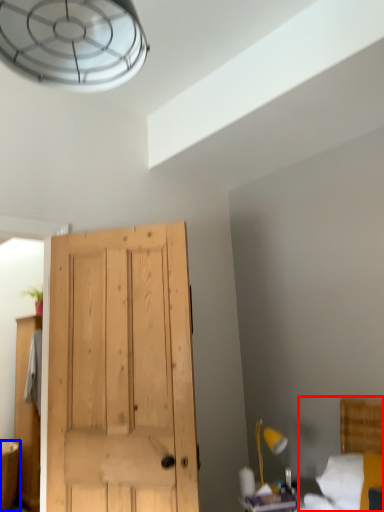
Question: Which object is further to the camera taking this photo, bed (highlighted by a red box) or vanity (highlighted by a blue box)?

Choices:
 (A) bed
 (B) vanity

Answer: (B)